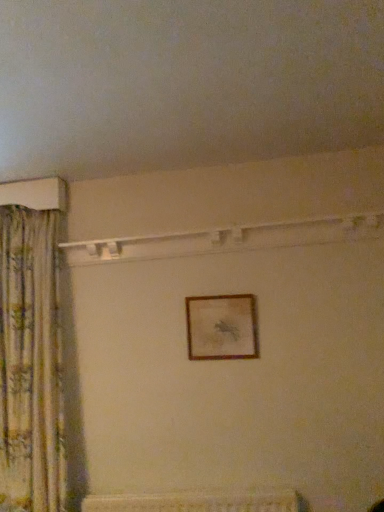
Question: Should I look upward or downward to see wooden picture frame at center?

Choices:
 (A) down
 (B) up

Answer: (A)

Question: Is wooden picture frame at center shorter than floral fabric curtain at left?

Choices:
 (A) yes
 (B) no

Answer: (A)

Question: From the image's perspective, is wooden picture frame at center located beneath floral fabric curtain at left?

Choices:
 (A) yes
 (B) no

Answer: (B)

Question: Would you say wooden picture frame at center contains floral fabric curtain at left?

Choices:
 (A) no
 (B) yes

Answer: (A)

Question: Considering the relative positions of wooden picture frame at center and floral fabric curtain at left in the image provided, is wooden picture frame at center to the left of floral fabric curtain at left from the viewer's perspective?

Choices:
 (A) yes
 (B) no

Answer: (B)

Question: From the image's perspective, does wooden picture frame at center appear higher than floral fabric curtain at left?

Choices:
 (A) yes
 (B) no

Answer: (A)

Question: From a real-world perspective, is wooden picture frame at center on floral fabric curtain at left?

Choices:
 (A) yes
 (B) no

Answer: (A)

Question: Is floral fabric curtain at left facing away from wooden picture frame at center?

Choices:
 (A) yes
 (B) no

Answer: (B)

Question: Is floral fabric curtain at left bigger than wooden picture frame at center?

Choices:
 (A) yes
 (B) no

Answer: (A)

Question: Is floral fabric curtain at left taller than wooden picture frame at center?

Choices:
 (A) yes
 (B) no

Answer: (A)

Question: From a real-world perspective, is floral fabric curtain at left physically above wooden picture frame at center?

Choices:
 (A) yes
 (B) no

Answer: (B)

Question: Is floral fabric curtain at left positioned far away from wooden picture frame at center?

Choices:
 (A) yes
 (B) no

Answer: (B)

Question: From the image's perspective, is floral fabric curtain at left located above wooden picture frame at center?

Choices:
 (A) no
 (B) yes

Answer: (A)

Question: Is wooden picture frame at center taller or shorter than floral fabric curtain at left?

Choices:
 (A) tall
 (B) short

Answer: (B)